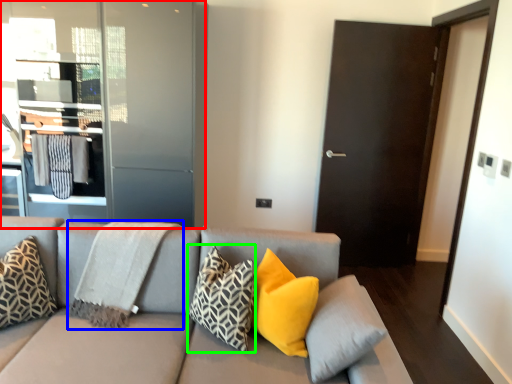
Question: Considering the real-world distances, which object is farthest from elevator (highlighted by a red box)? blanket (highlighted by a blue box) or pillow (highlighted by a green box)?

Choices:
 (A) blanket
 (B) pillow

Answer: (B)